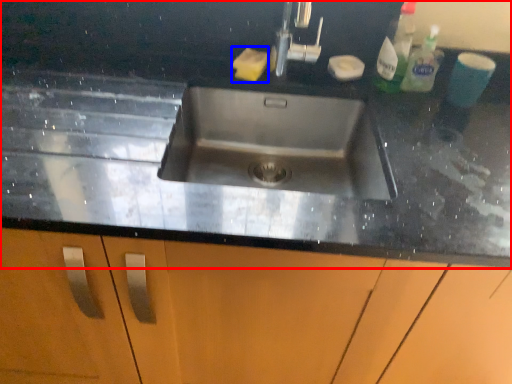
Question: Which object appears farthest to the camera in this image, countertop (highlighted by a red box) or soap (highlighted by a blue box)?

Choices:
 (A) countertop
 (B) soap

Answer: (B)